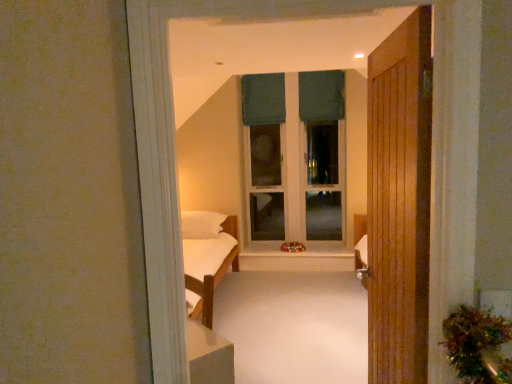
Question: Considering the relative sizes of dark green fabric at upper center, acting as the 1th curtain starting from the right, and white wood at center in the image provided, is dark green fabric at upper center, acting as the 1th curtain starting from the right, smaller than white wood at center?

Choices:
 (A) yes
 (B) no

Answer: (B)

Question: Can you confirm if dark green fabric at upper center, which appears as the second curtain when viewed from the left, is wider than white wood at center?

Choices:
 (A) no
 (B) yes

Answer: (A)

Question: Could you tell me if dark green fabric at upper center, acting as the 1th curtain starting from the right, is turned towards white wood at center?

Choices:
 (A) yes
 (B) no

Answer: (B)

Question: Considering the relative sizes of dark green fabric at upper center, which appears as the second curtain when viewed from the left, and white wood at center in the image provided, is dark green fabric at upper center, which appears as the second curtain when viewed from the left, thinner than white wood at center?

Choices:
 (A) yes
 (B) no

Answer: (A)

Question: Is dark green fabric at upper center, which appears as the second curtain when viewed from the left, positioned in front of white wood at center?

Choices:
 (A) yes
 (B) no

Answer: (B)

Question: Is dark green fabric at upper center, which appears as the second curtain when viewed from the left, to the left of white wood at center from the viewer's perspective?

Choices:
 (A) no
 (B) yes

Answer: (A)

Question: Considering the relative sizes of dark green fabric curtain at upper center, placed as the first curtain when sorted from left to right, and wooden door at right in the image provided, is dark green fabric curtain at upper center, placed as the first curtain when sorted from left to right, smaller than wooden door at right?

Choices:
 (A) yes
 (B) no

Answer: (A)

Question: Considering the relative sizes of dark green fabric curtain at upper center, the second curtain in the right-to-left sequence, and wooden door at right in the image provided, is dark green fabric curtain at upper center, the second curtain in the right-to-left sequence, wider than wooden door at right?

Choices:
 (A) no
 (B) yes

Answer: (A)

Question: Is dark green fabric curtain at upper center, placed as the first curtain when sorted from left to right, thinner than wooden door at right?

Choices:
 (A) no
 (B) yes

Answer: (B)

Question: Is wooden door at right completely or partially inside dark green fabric curtain at upper center, the second curtain in the right-to-left sequence?

Choices:
 (A) no
 (B) yes

Answer: (A)

Question: From the image's perspective, is dark green fabric curtain at upper center, placed as the first curtain when sorted from left to right, below wooden door at right?

Choices:
 (A) no
 (B) yes

Answer: (A)

Question: Is dark green fabric curtain at upper center, the second curtain in the right-to-left sequence, completely or partially outside of wooden door at right?

Choices:
 (A) no
 (B) yes

Answer: (B)

Question: Is the depth of dark green fabric curtain at upper center, placed as the first curtain when sorted from left to right, greater than that of white wood at center?

Choices:
 (A) no
 (B) yes

Answer: (B)